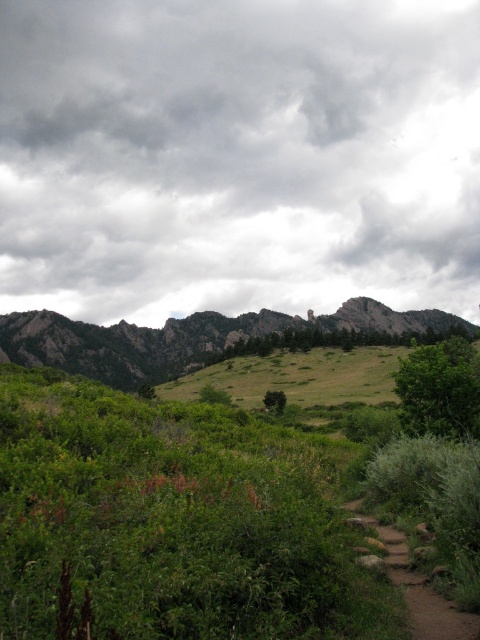
You are an outdoor photographer planning to capture the cloudy gray sky at upper center and the green leafy shrubs at center in the same frame. Based on their positions, which object should you adjust your camera to focus on first to ensure both are in the shot?

The cloudy gray sky at upper center is to the right of green leafy shrubs at center, so you should focus on the green leafy shrubs at center first to ensure both are included in the frame.

You are a hiker planning to take a photo of the cloudy gray sky at upper center and the green leafy shrubs at center from a specific spot. If your camera can focus on objects up to 400 meters away, will both subjects be in focus?

The cloudy gray sky at upper center is 418.88 meters away from green leafy shrubs at center. Since the distance exceeds the camera maximum focus range of 400 meters, both subjects cannot be in focus at the same time.

You are planning a hiking route and see the point marked at coordinate (175,522). What type of terrain feature is located at that point?

The point at coordinate (175,522) indicates green leafy shrubs at center, so the terrain feature there is green leafy shrubs.